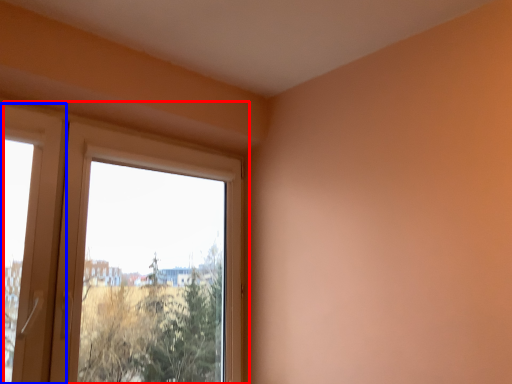
Question: Which object appears farthest to the camera in this image, window (highlighted by a red box) or screen door (highlighted by a blue box)?

Choices:
 (A) window
 (B) screen door

Answer: (A)